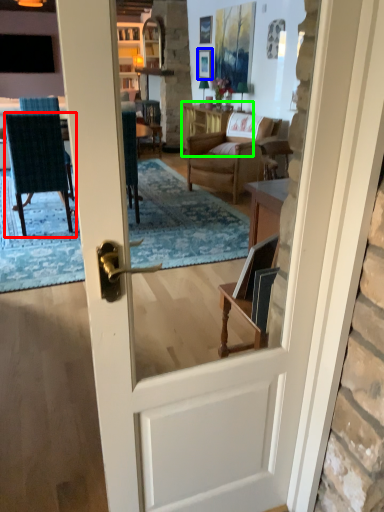
Question: Considering the real-world distances, which object is farthest from chair (highlighted by a red box)? picture frame (highlighted by a blue box) or table (highlighted by a green box)?

Choices:
 (A) picture frame
 (B) table

Answer: (A)